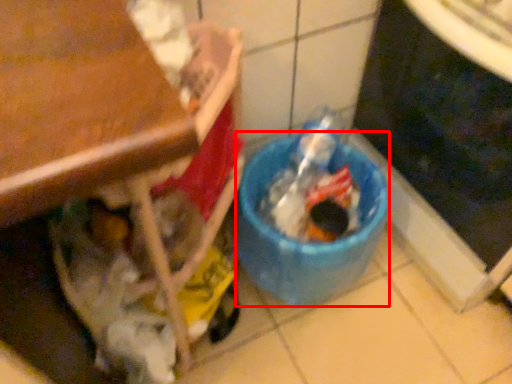
Question: In this image, where is recycling bin (annotated by the red box) located relative to appliance?

Choices:
 (A) left
 (B) right

Answer: (A)